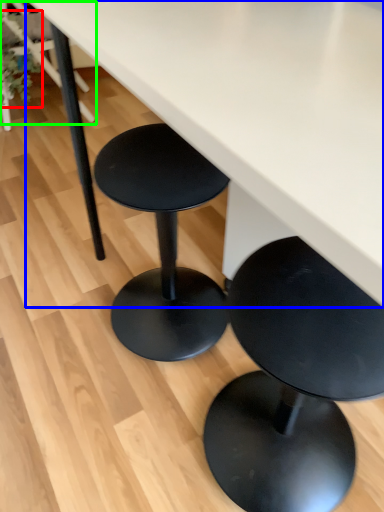
Question: Estimate the real-world distances between objects in this image. Which object is closer to plant (highlighted by a red box), table (highlighted by a blue box) or chair (highlighted by a green box)?

Choices:
 (A) table
 (B) chair

Answer: (B)